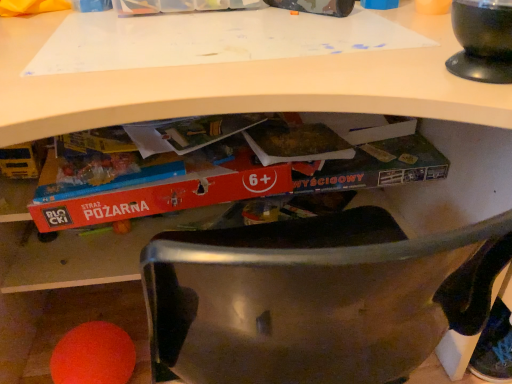
At what (x,y) coordinates should I click in order to perform the action: click on black glossy bowl at upper right. Please return your answer as a coordinate pair (x, y). Looking at the image, I should click on (482, 40).

What do you see at coordinates (482, 40) in the screenshot? This screenshot has height=384, width=512. I see `black glossy bowl at upper right` at bounding box center [482, 40].

Describe the element at coordinates (263, 168) in the screenshot. I see `red cardboard book at center` at that location.

This screenshot has height=384, width=512. Identify the location of red cardboard book at center. click(263, 168).

Measure the distance between red cardboard book at center and camera.

red cardboard book at center and camera are 31.02 inches apart.

Identify the location of black glossy bowl at upper right. Image resolution: width=512 pixels, height=384 pixels. (482, 40).

Is red cardboard book at center at the left side of black glossy bowl at upper right?

Indeed, red cardboard book at center is positioned on the left side of black glossy bowl at upper right.

Which object is closer to the camera taking this photo, red cardboard book at center or black glossy bowl at upper right?

Positioned in front is black glossy bowl at upper right.

Which is farther from the camera, (288, 169) or (511, 28)?

The point (288, 169) is more distant.

From the image's perspective, between red cardboard book at center and black glossy bowl at upper right, who is located below?

red cardboard book at center is shown below in the image.

From the picture: From a real-world perspective, which is physically below, red cardboard book at center or black glossy bowl at upper right?

From a 3D spatial view, red cardboard book at center is below.

Which of these two, red cardboard book at center or black glossy bowl at upper right, is wider?

red cardboard book at center is wider.

Who is taller, red cardboard book at center or black glossy bowl at upper right?

red cardboard book at center.

Considering the sizes of objects red cardboard book at center and black glossy bowl at upper right in the image provided, who is smaller, red cardboard book at center or black glossy bowl at upper right?

Smaller between the two is black glossy bowl at upper right.

Consider the image. Does red cardboard book at center contain black glossy bowl at upper right?

Definitely not — black glossy bowl at upper right is not inside red cardboard book at center.

Is red cardboard book at center far away from black glossy bowl at upper right?

They are positioned close to each other.

Looking at this image, is red cardboard book at center facing towards black glossy bowl at upper right?

No.

Locate an element on the screen. appliance above the red cardboard book at center (from the image's perspective) is located at coordinates (482, 40).

Is black glossy bowl at upper right to the left of red cardboard book at center from the viewer's perspective?

No.

Considering the positions of objects black glossy bowl at upper right and red cardboard book at center in the image provided, who is in front, black glossy bowl at upper right or red cardboard book at center?

black glossy bowl at upper right is in front.

Considering the positions of points (463, 22) and (168, 159), is point (463, 22) closer to camera compared to point (168, 159)?

Yes, it is in front of point (168, 159).

From the image's perspective, is black glossy bowl at upper right above red cardboard book at center?

Correct, black glossy bowl at upper right appears higher than red cardboard book at center in the image.

From a real-world perspective, is black glossy bowl at upper right above or below red cardboard book at center?

black glossy bowl at upper right is situated higher than red cardboard book at center in the real world.

Can you confirm if black glossy bowl at upper right is thinner than red cardboard book at center?

Indeed, black glossy bowl at upper right has a lesser width compared to red cardboard book at center.

Between black glossy bowl at upper right and red cardboard book at center, which one has less height?

black glossy bowl at upper right.

Based on their sizes in the image, would you say black glossy bowl at upper right is bigger or smaller than red cardboard book at center?

In the image, black glossy bowl at upper right appears to be smaller than red cardboard book at center.

Would you say red cardboard book at center is part of black glossy bowl at upper right's contents?

That's incorrect, red cardboard book at center is not inside black glossy bowl at upper right.

Are black glossy bowl at upper right and red cardboard book at center far apart?

No, black glossy bowl at upper right is not far from red cardboard book at center.

Is black glossy bowl at upper right oriented away from red cardboard book at center?

No, black glossy bowl at upper right's orientation is not away from red cardboard book at center.

What's the angular difference between black glossy bowl at upper right and red cardboard book at center's facing directions?

The facing directions of black glossy bowl at upper right and red cardboard book at center are 15.7 degrees apart.

The width and height of the screenshot is (512, 384). In order to click on appliance above the red cardboard book at center (from a real-world perspective) in this screenshot , I will do `click(482, 40)`.

Identify the location of paperback book that appears below the black glossy bowl at upper right (from a real-world perspective). This screenshot has height=384, width=512. (263, 168).

Locate an element on the screen. The image size is (512, 384). paperback book that appears on the left of black glossy bowl at upper right is located at coordinates (263, 168).